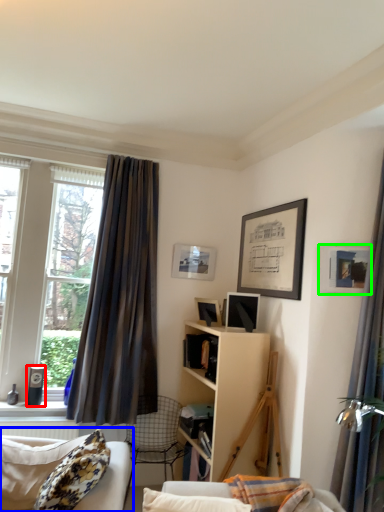
Question: Based on their relative distances, which object is farther from speaker (highlighted by a red box)? Choose from studio couch (highlighted by a blue box) and picture frame (highlighted by a green box).

Choices:
 (A) studio couch
 (B) picture frame

Answer: (B)